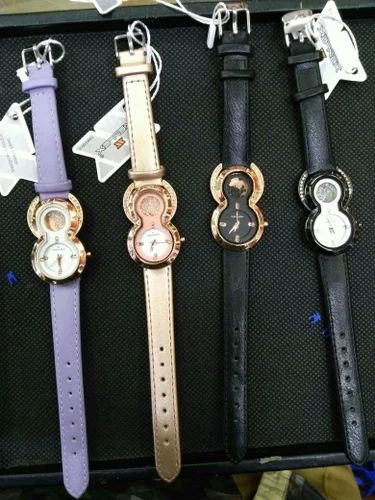
Find the location of a particular element. The image size is (375, 500). black edge of display case is located at coordinates (307, 462), (158, 11), (156, 342).